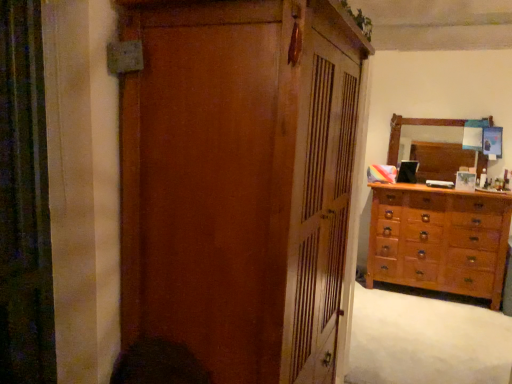
Question: Looking at their shapes, would you say matte wood cupboard at center is wider or thinner than light brown wooden dresser at right?

Choices:
 (A) wide
 (B) thin

Answer: (A)

Question: Considering the positions of point (265, 205) and point (500, 294), is point (265, 205) closer or farther from the camera than point (500, 294)?

Choices:
 (A) farther
 (B) closer

Answer: (B)

Question: Which is farther from the light brown wooden dresser at right?

Choices:
 (A) wooden dresser at lower right
 (B) wooden mirror at upper right
 (C) matte wood cupboard at center

Answer: (C)

Question: Considering the real-world distances, which object is farthest from the wooden dresser at lower right?

Choices:
 (A) light brown wooden dresser at right
 (B) matte wood cupboard at center
 (C) wooden mirror at upper right

Answer: (B)